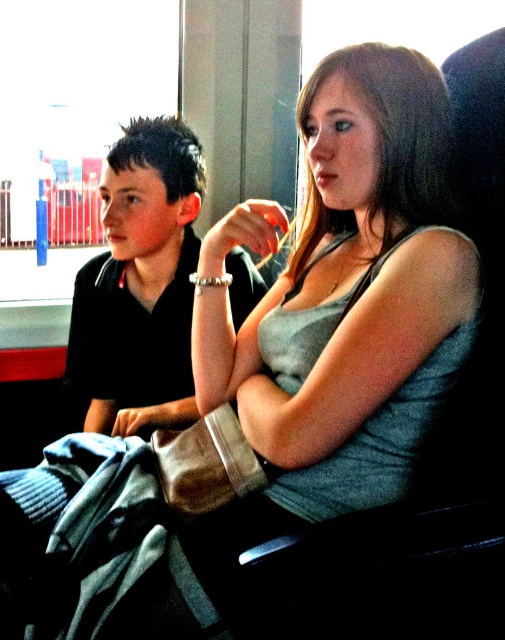
Question: Is gray cotton tank top at center to the right of black matte shirt at left from the viewer's perspective?

Choices:
 (A) yes
 (B) no

Answer: (A)

Question: Which object is closer to the camera taking this photo?

Choices:
 (A) black matte shirt at left
 (B) gray cotton tank top at center

Answer: (B)

Question: Can you confirm if gray cotton tank top at center is thinner than black matte shirt at left?

Choices:
 (A) no
 (B) yes

Answer: (B)

Question: Which point is closer to the camera?

Choices:
 (A) [160, 131]
 (B) [205, 250]

Answer: (B)

Question: Can you confirm if gray cotton tank top at center is smaller than black matte shirt at left?

Choices:
 (A) no
 (B) yes

Answer: (A)